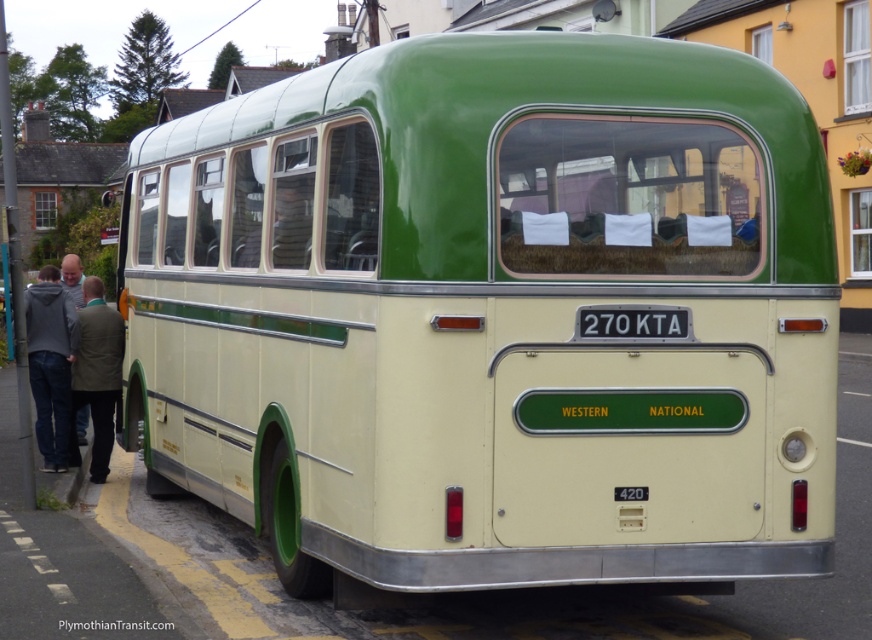
Does gray hoodie at left appear over white plastic license plate at center?

Actually, gray hoodie at left is below white plastic license plate at center.

Does gray hoodie at left have a lesser width compared to white plastic license plate at center?

Yes.

Which is in front, point (33, 285) or point (678, 308)?

Point (678, 308)

I want to click on gray hoodie at left, so (x=50, y=364).

Who is lower down, green fabric jacket at left or white plastic license plate at center?

green fabric jacket at left is lower down.

The image size is (872, 640). Describe the element at coordinates (97, 371) in the screenshot. I see `green fabric jacket at left` at that location.

Is point (113, 348) more distant than point (632, 332)?

Yes, point (113, 348) is behind point (632, 332).

You are a GUI agent. You are given a task and a screenshot of the screen. Output one action in this format:
    pyautogui.click(x=<x>, y=<y>)
    Task: Click on the green fabric jacket at left
    
    Given the screenshot: What is the action you would take?
    pyautogui.click(x=97, y=371)

Does gray hoodie at left appear under green fabric jacket at left?

Incorrect, gray hoodie at left is not positioned below green fabric jacket at left.

Who is more forward, (58, 461) or (116, 333)?

Positioned in front is point (116, 333).

This screenshot has height=640, width=872. Find the location of `gray hoodie at left`. gray hoodie at left is located at coordinates (50, 364).